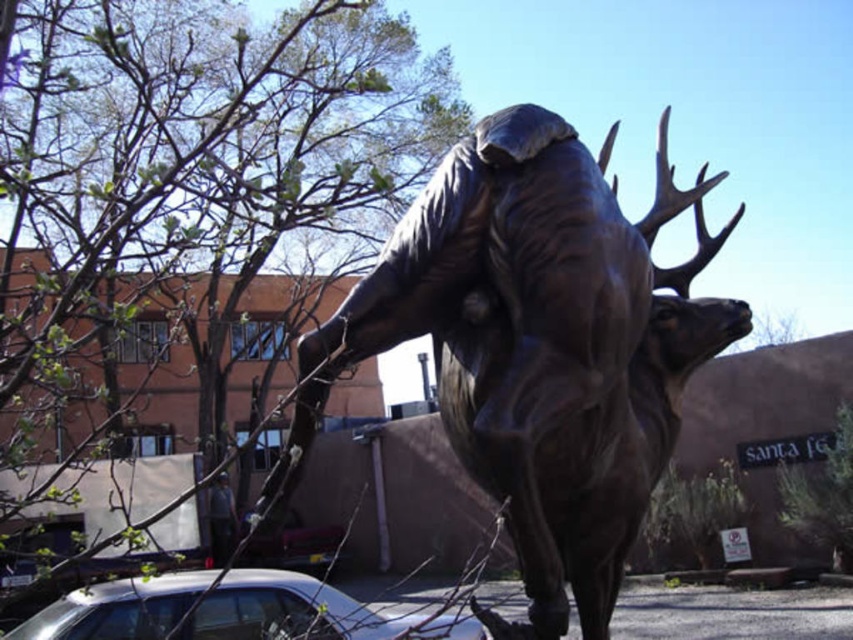
Question: Which is farther from the bronze statue at center?

Choices:
 (A) silver metallic car at lower left
 (B) dark gray fabric at lower left

Answer: (B)

Question: Which point is farther to the camera?

Choices:
 (A) (595, 371)
 (B) (231, 506)
 (C) (340, 620)

Answer: (B)

Question: Considering the real-world distances, which object is closest to the bronze statue at center?

Choices:
 (A) silver metallic car at lower left
 (B) dark gray fabric at lower left

Answer: (A)

Question: In this image, where is bronze statue at center located relative to silver metallic car at lower left?

Choices:
 (A) left
 (B) right

Answer: (B)

Question: Is silver metallic car at lower left to the left of dark gray fabric at lower left from the viewer's perspective?

Choices:
 (A) yes
 (B) no

Answer: (B)

Question: Does bronze statue at center appear under silver metallic car at lower left?

Choices:
 (A) yes
 (B) no

Answer: (B)